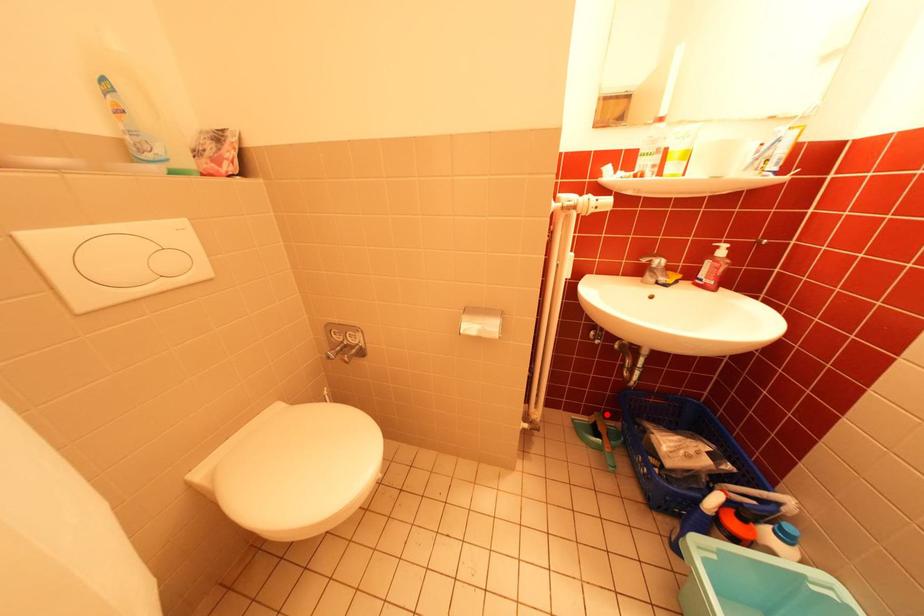
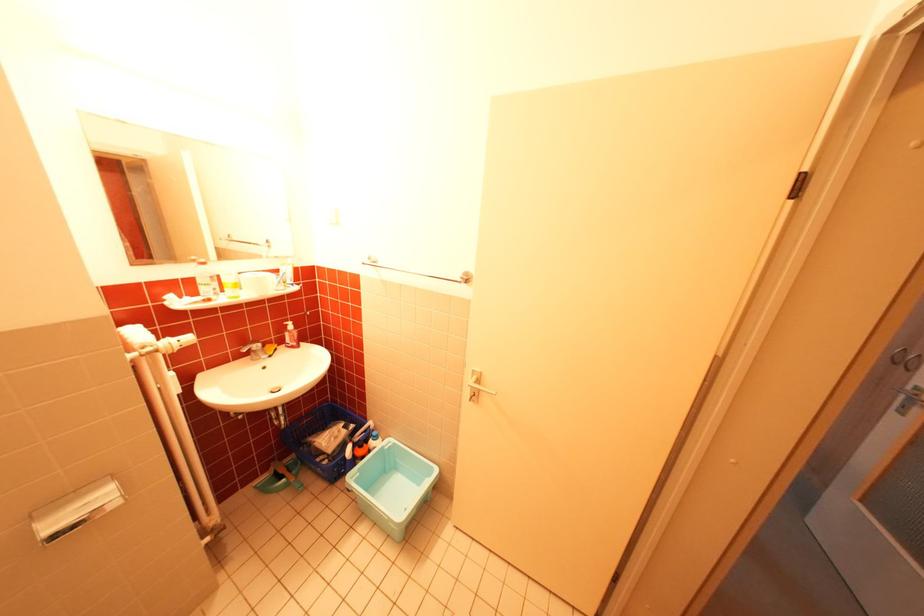
Locate, in the second image, the point that corresponds to the highlighted location in the first image.

(283, 464)